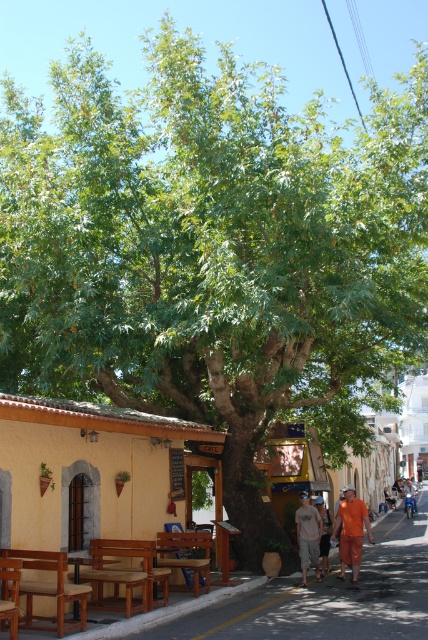
Who is lower down, brown wooden picnic table at center or orange cotton shorts at center?

orange cotton shorts at center is lower down.

Between brown wooden picnic table at center and orange cotton shorts at center, which one has less height?

brown wooden picnic table at center

From the picture: Who is more distant from viewer, (x=199, y=579) or (x=347, y=516)?

Point (x=347, y=516)

Identify the location of brown wooden picnic table at center. The height and width of the screenshot is (640, 428). (186, 557).

This screenshot has width=428, height=640. What do you see at coordinates (186, 557) in the screenshot?
I see `brown wooden picnic table at center` at bounding box center [186, 557].

Is brown wooden picnic table at center bigger than orange cotton shirt at center?

Actually, brown wooden picnic table at center might be smaller than orange cotton shirt at center.

Between point (184, 538) and point (320, 502), which one is positioned in front?

Point (184, 538) is in front.

This screenshot has width=428, height=640. Find the location of `brown wooden picnic table at center`. brown wooden picnic table at center is located at coordinates (186, 557).

Who is more forward, [385,595] or [318,573]?

Point [385,595] is more forward.

Which is above, smooth concrete pavement at lower center or light brown cotton shorts at lower center?

light brown cotton shorts at lower center is above.

Find the location of a particular element. smooth concrete pavement at lower center is located at coordinates (312, 600).